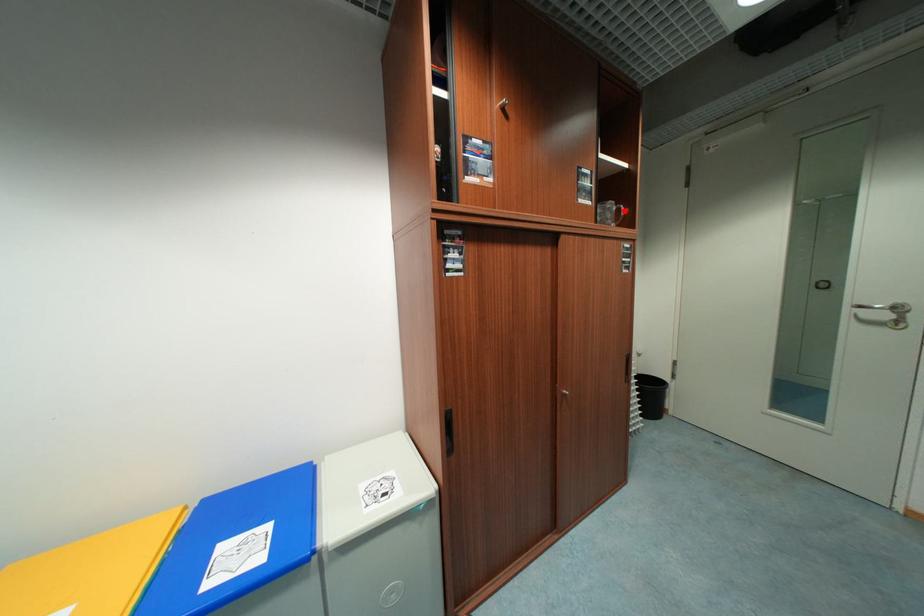
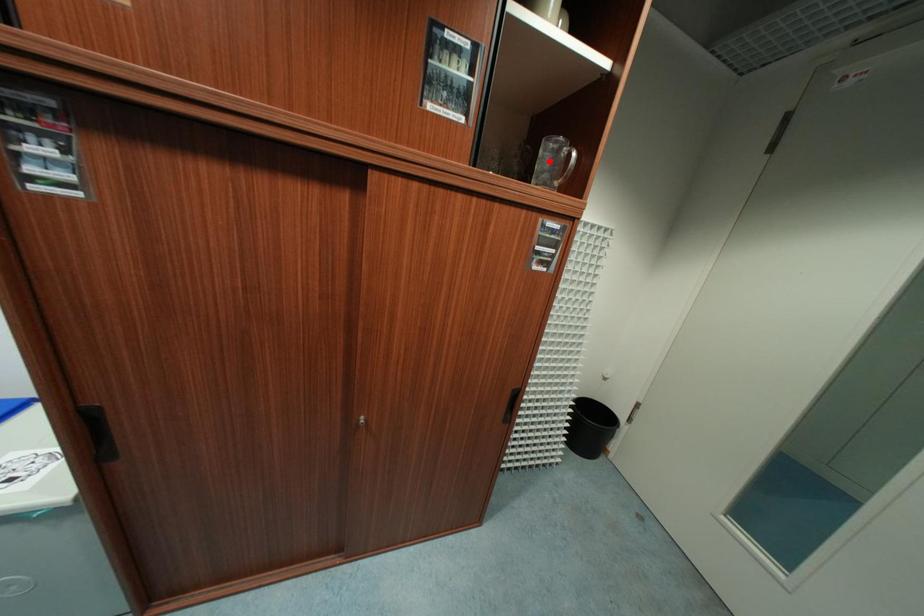
I am providing you with two images of the same scene from different viewpoints. A red point is marked on the first image and another point is marked on the second image. Do the highlighted points in image1 and image2 indicate the same real-world spot?

No